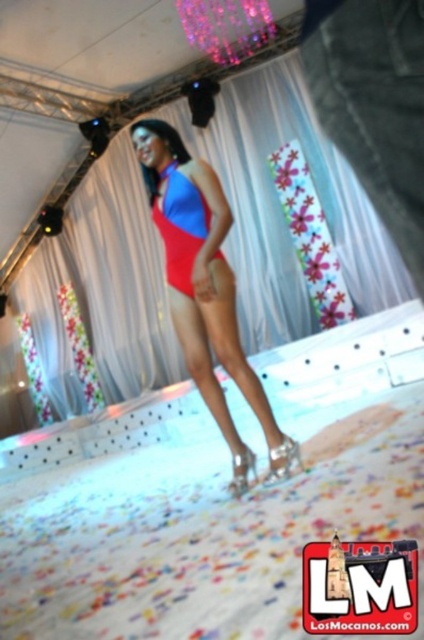
You are a photographer positioned at the front of the runway. You notice two points marked in the image. The first point is at coordinate point [125,323] and the second is at point [194,214]. Which point is closer to your camera lens?

Point [125,323] is closer to the camera lens because it is further to the viewer than point [194,214].

You are a fashion designer observing the runway show. You notice the matte red swimsuit at upper center and the matte blue bikini top at center. Which one has a larger size?

The matte blue bikini top at center is larger than the matte red swimsuit at upper center.

You are a photographer at the fashion show. You need to capture a photo where the white sheer curtain at center and the matte red swimsuit at center are both visible. Which object should you position to the right side in your camera frame?

The white sheer curtain at center should be positioned to the right side in your camera frame because it is already on the right side of the matte red swimsuit at center.